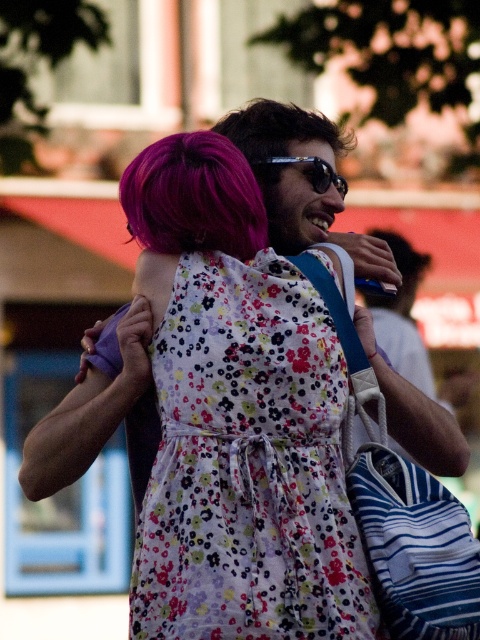
Does purple matte hair at upper right have a larger size compared to sunglasses at center?

Yes.

Is point (394, 248) positioned after point (315, 173)?

Yes, point (394, 248) is farther from viewer.

Is point (405, 237) positioned behind point (266, 163)?

Yes, point (405, 237) is behind point (266, 163).

What are the coordinates of `purple matte hair at upper right` in the screenshot? It's located at (400, 273).

Does floral cotton dress at center have a greater height compared to sunglasses at center?

Correct, floral cotton dress at center is much taller as sunglasses at center.

The height and width of the screenshot is (640, 480). What do you see at coordinates (248, 465) in the screenshot?
I see `floral cotton dress at center` at bounding box center [248, 465].

Who is more distant from viewer, (x=255, y=349) or (x=312, y=172)?

The point (x=312, y=172) is behind.

Where is `floral cotton dress at center`? floral cotton dress at center is located at coordinates [248, 465].

Is point (294, 436) in front of point (181, 173)?

That is True.

This screenshot has width=480, height=640. Find the location of `floral cotton dress at center`. floral cotton dress at center is located at coordinates (248, 465).